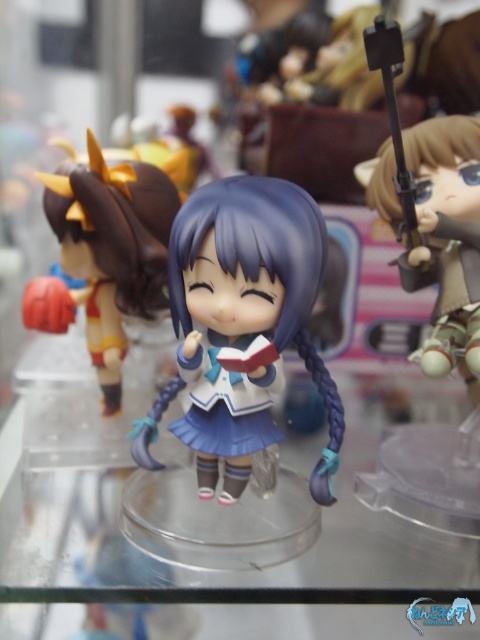
Question: Estimate the real-world distances between objects in this image. Which object is closer to the satin blue dress at center?

Choices:
 (A) satin purple doll at center
 (B) transparent plastic glass table at center

Answer: (A)

Question: Does transparent plastic glass table at center have a lesser width compared to satin blue dress at center?

Choices:
 (A) yes
 (B) no

Answer: (B)

Question: Which of the following is the closest to the observer?

Choices:
 (A) satin blue dress at center
 (B) transparent plastic glass table at center

Answer: (B)

Question: Can you confirm if transparent plastic glass table at center is positioned below satin blue dress at center?

Choices:
 (A) yes
 (B) no

Answer: (A)

Question: Is the position of transparent plastic glass table at center more distant than that of satin blue dress at center?

Choices:
 (A) yes
 (B) no

Answer: (B)

Question: Which point appears closest to the camera in this image?

Choices:
 (A) (284, 625)
 (B) (93, 236)
 (C) (292, 193)

Answer: (A)